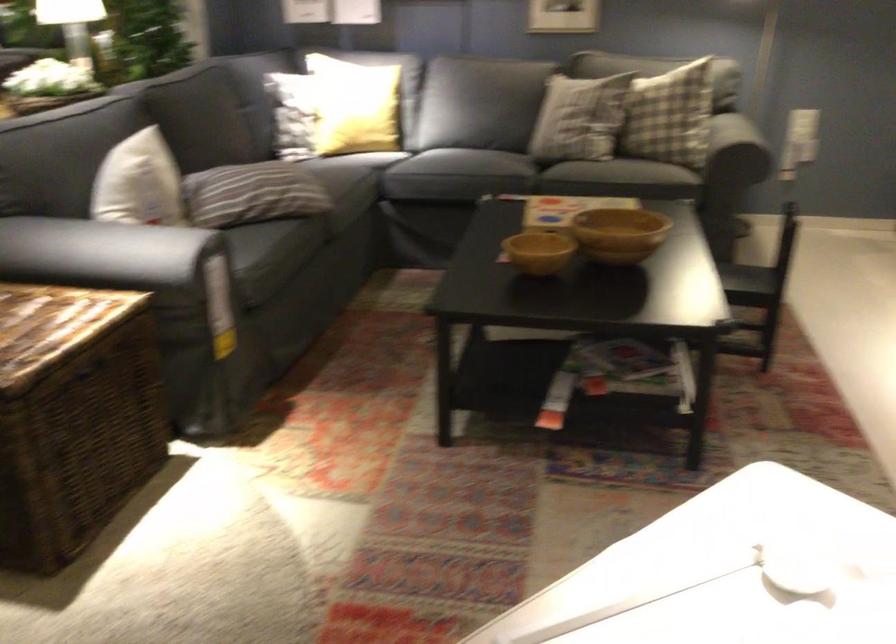
Where would you lift the small wooden bowl? Please return your answer as a coordinate pair (x, y).

(618, 234)